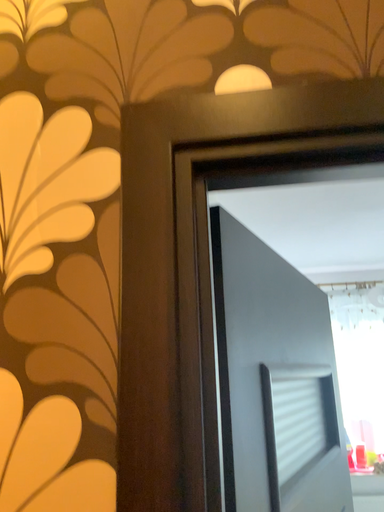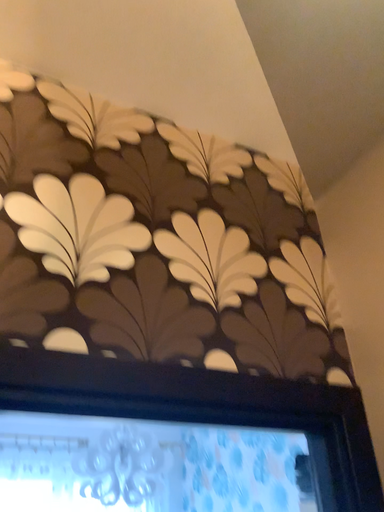
Question: Which way did the camera rotate in the video?

Choices:
 (A) rotated right
 (B) rotated left

Answer: (A)